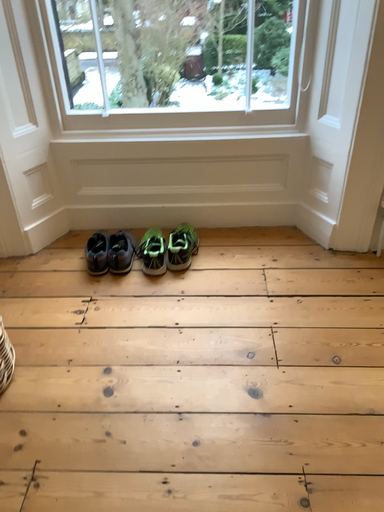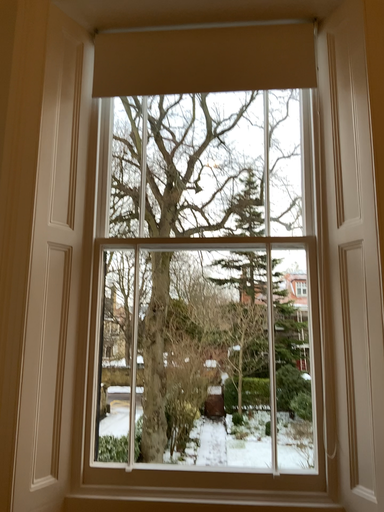
Question: Which way did the camera rotate in the video?

Choices:
 (A) rotated upward
 (B) rotated downward

Answer: (A)